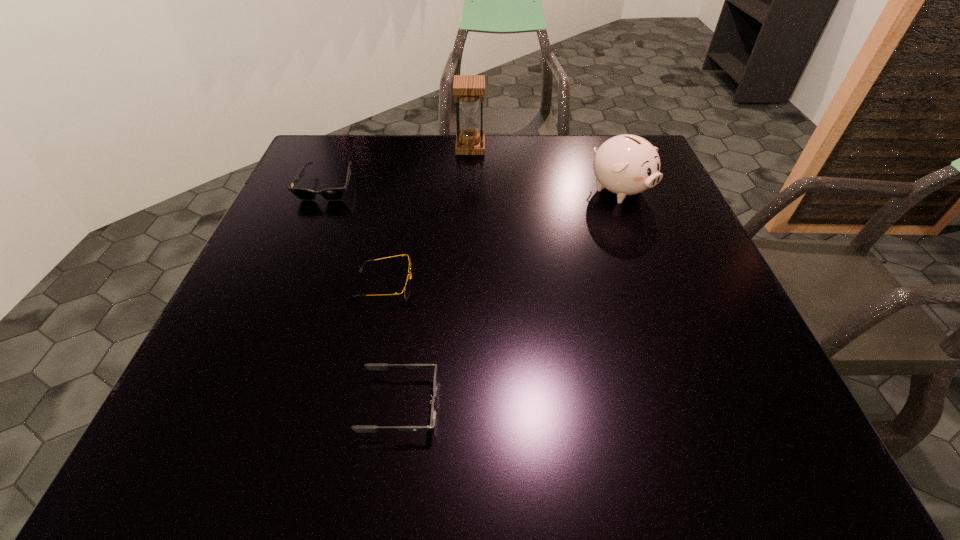
Image resolution: width=960 pixels, height=540 pixels. Find the location of `free space located 0.360m on the front-facing side of the farthest sunglasses`. free space located 0.360m on the front-facing side of the farthest sunglasses is located at coordinates (273, 316).

Locate an element on the screen. vacant region located on the front-facing side of the fourth farthest object is located at coordinates (588, 285).

Find the location of a particular element. The width and height of the screenshot is (960, 540). vacant space located on the temples of the nearest object is located at coordinates (628, 405).

Identify the location of hourglass that is at the far edge. (468, 88).

At what (x,y) coordinates should I click in order to perform the action: click on piggy bank that is at the far edge. Please return your answer as a coordinate pair (x, y). This screenshot has height=540, width=960. Looking at the image, I should click on (626, 164).

At what (x,y) coordinates should I click in order to perform the action: click on sunglasses located at the far edge. Please return your answer as a coordinate pair (x, y). The image size is (960, 540). Looking at the image, I should click on (332, 194).

Locate an element on the screen. This screenshot has height=540, width=960. object that is at the near edge is located at coordinates (371, 366).

The height and width of the screenshot is (540, 960). What are the coordinates of `object located in the left edge section of the desktop` in the screenshot? It's located at (332, 194).

Where is `object situated at the right edge`? object situated at the right edge is located at coordinates (626, 164).

The image size is (960, 540). Find the location of `object that is at the far left corner`. object that is at the far left corner is located at coordinates (332, 194).